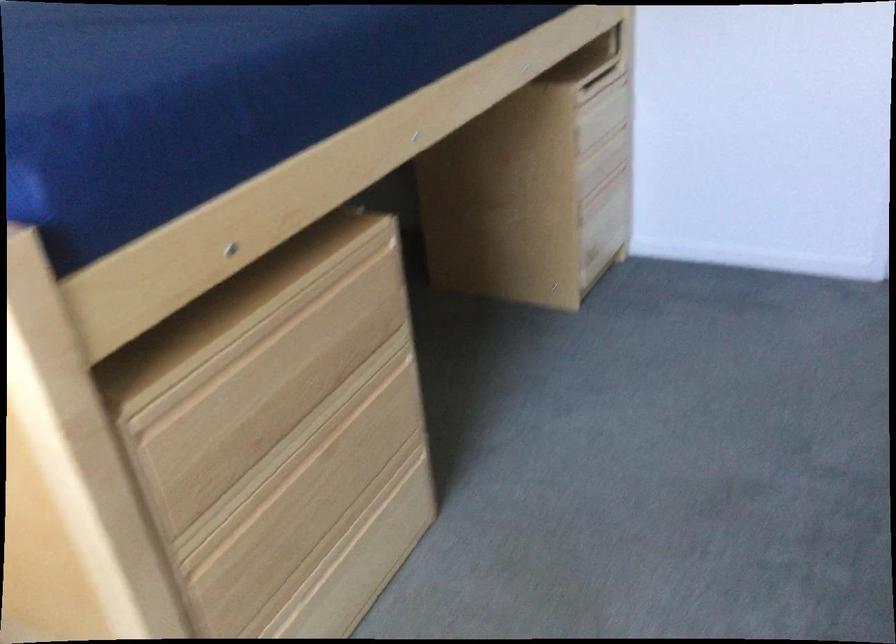
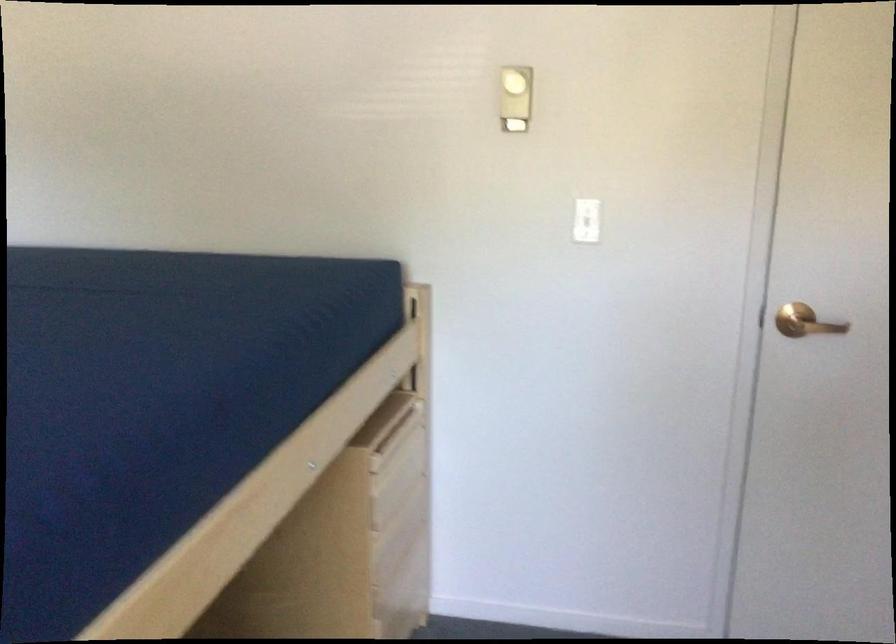
Question: Which direction would the cameraman need to move to produce the second image? Reply with the corresponding letter.

Choices:
 (A) Left
 (B) Right
 (C) Forward
 (D) Backward

Answer: (C)